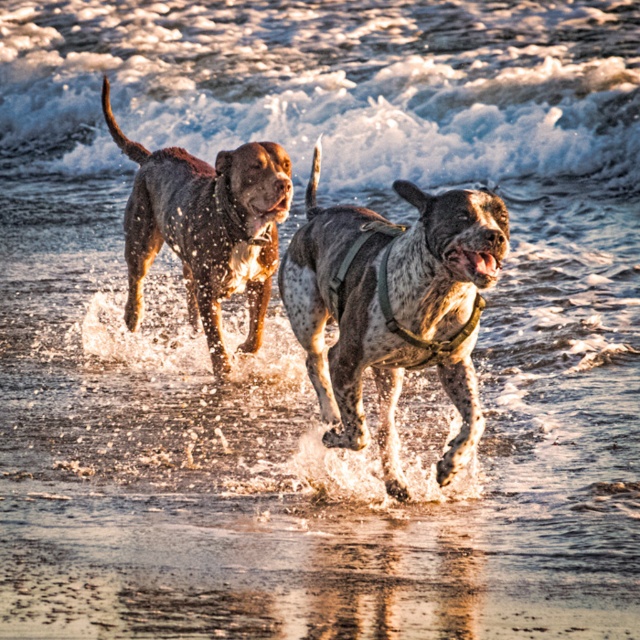
Question: Can you confirm if speckled fur dog at center is bigger than shiny brown dog at center?

Choices:
 (A) yes
 (B) no

Answer: (B)

Question: Which point appears closest to the camera in this image?

Choices:
 (A) [x=208, y=257]
 (B) [x=353, y=275]

Answer: (B)

Question: Among these objects, which one is nearest to the camera?

Choices:
 (A) white textured foam at upper center
 (B) shiny brown dog at center

Answer: (B)

Question: Which of the following is the closest to the observer?

Choices:
 (A) (92, 150)
 (B) (204, 188)
 (C) (339, 314)

Answer: (C)

Question: Is white textured foam at upper center bigger than shiny brown dog at center?

Choices:
 (A) yes
 (B) no

Answer: (A)

Question: Can you confirm if speckled fur dog at center is positioned below shiny brown dog at center?

Choices:
 (A) yes
 (B) no

Answer: (A)